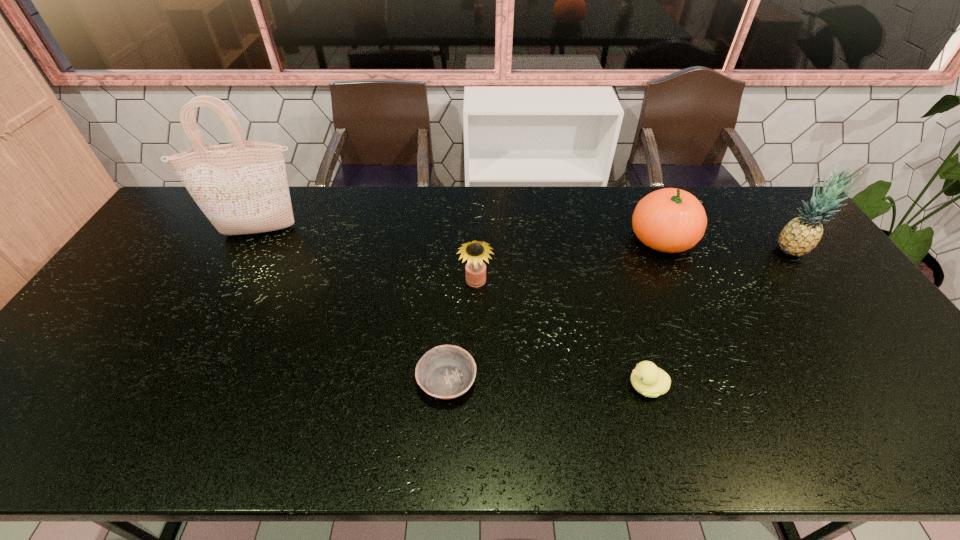
Where is `vacant region at the far edge`? Image resolution: width=960 pixels, height=540 pixels. vacant region at the far edge is located at coordinates (450, 215).

The height and width of the screenshot is (540, 960). What are the coordinates of `free region at the near edge of the desktop` in the screenshot? It's located at (823, 431).

This screenshot has height=540, width=960. Find the location of `free space at the left edge of the desktop`. free space at the left edge of the desktop is located at coordinates tap(95, 327).

Find the location of `vacant area between the third nearest object and the second tallest object`. vacant area between the third nearest object and the second tallest object is located at coordinates (634, 266).

I want to click on free spot between the bowl and the tallest object, so click(x=353, y=306).

Image resolution: width=960 pixels, height=540 pixels. What are the coordinates of `free space between the shortest object and the shopping bag` in the screenshot? It's located at (353, 306).

You are a GUI agent. You are given a task and a screenshot of the screen. Output one action in this format:
    pyautogui.click(x=<x>, y=<y>)
    Task: Click on the free spot between the third nearest object and the second shortest object
    The image size is (960, 540).
    Given the screenshot: What is the action you would take?
    pyautogui.click(x=562, y=335)

Image resolution: width=960 pixels, height=540 pixels. Find the location of `free spot between the second shortest object and the shortest object`. free spot between the second shortest object and the shortest object is located at coordinates (546, 383).

Identify the location of free space that is in between the second shortest object and the leftmost object. (453, 309).

The image size is (960, 540). I want to click on vacant point located between the leftmost object and the second object from right to left, so click(461, 235).